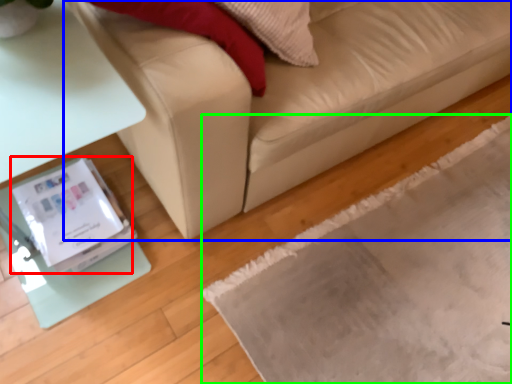
Question: Which object is the farthest from Wii (highlighted by a red box)? Choose among these: studio couch (highlighted by a blue box) or mat (highlighted by a green box).

Choices:
 (A) studio couch
 (B) mat

Answer: (B)